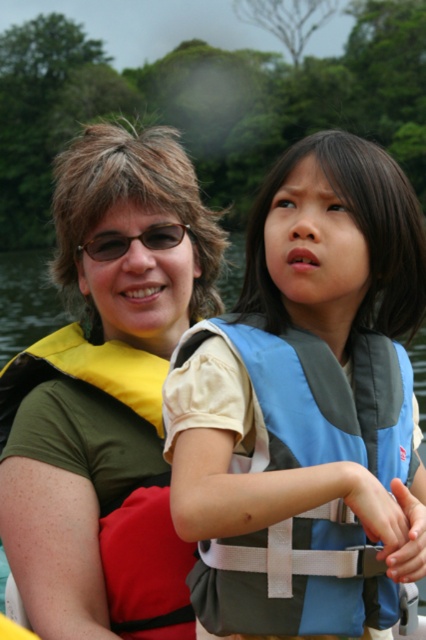
You are a photographer trying to capture a clear shot of the blue fabric life vest at center and the matte black glasses at upper center. Which object is closer to the camera?

The blue fabric life vest at center is closer to the camera because it is in front of the matte black glasses at upper center.

Looking at this image, you are a lifeguard at a lake and see two people wearing life jackets. The blue fabric life vest at center is being worn by a child, and the yellow fabric life vest at left is worn by an adult. Based on their life jackets, which person is taller?

The yellow fabric life vest at left is taller than the blue fabric life vest at center. Since the adult is wearing the yellow one, the adult is taller.

You are standing at the point marked by coordinates (106, 397) in the image. What object is located at this point?

The point marked by coordinates (106, 397) is located at the yellow fabric life vest at left.